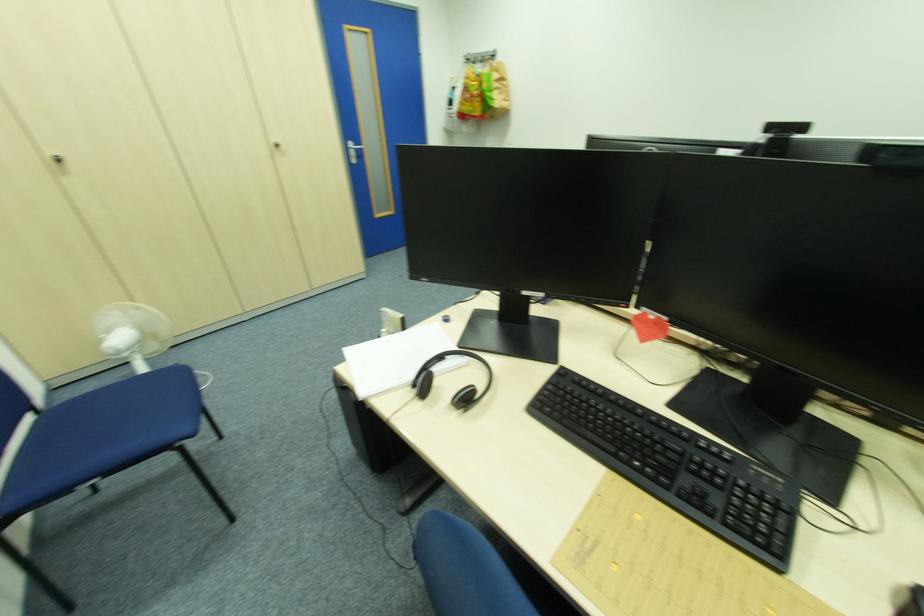
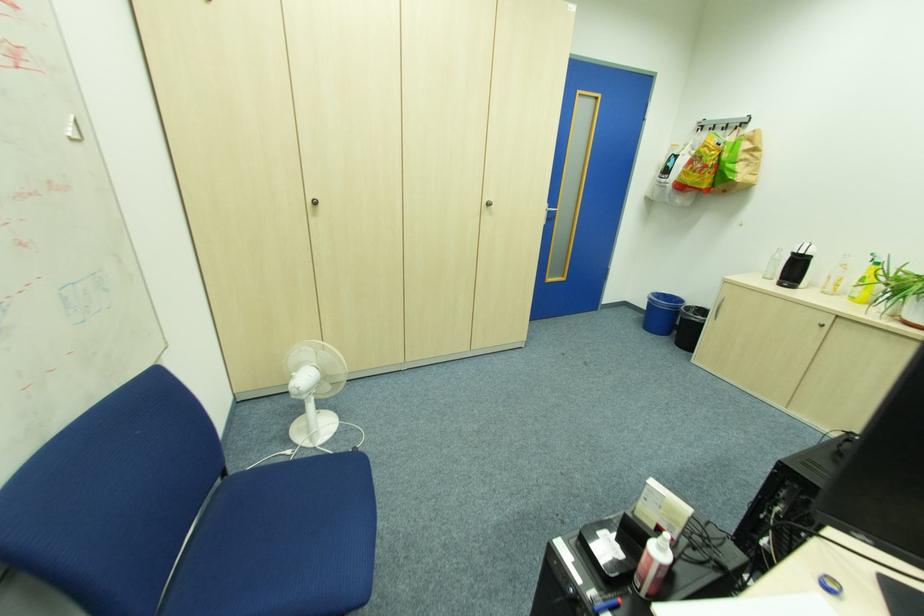
Question: Based on the continuous images, in which direction is the camera rotating? Reply with the corresponding letter.

Choices:
 (A) Left
 (B) Right
 (C) Up
 (D) Down

Answer: (A)